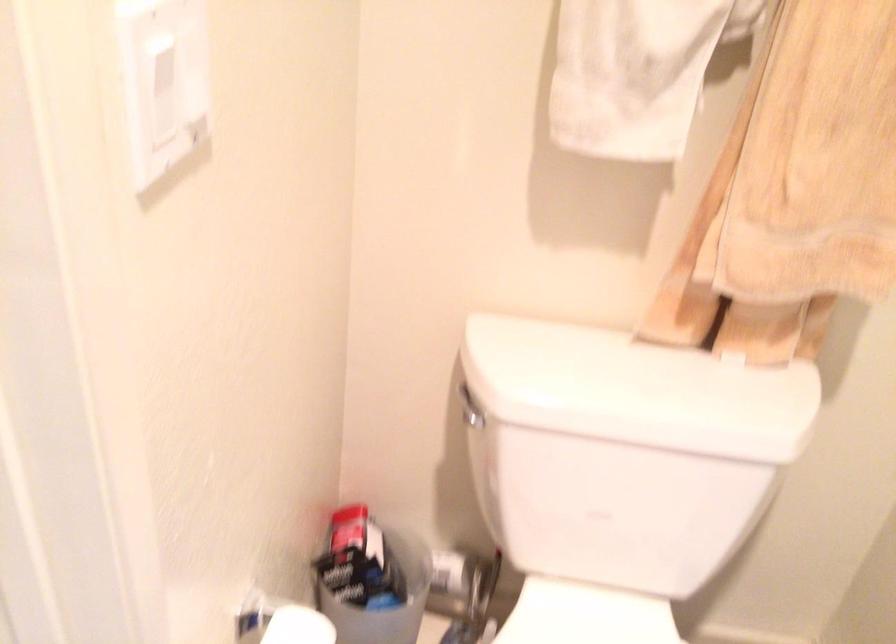
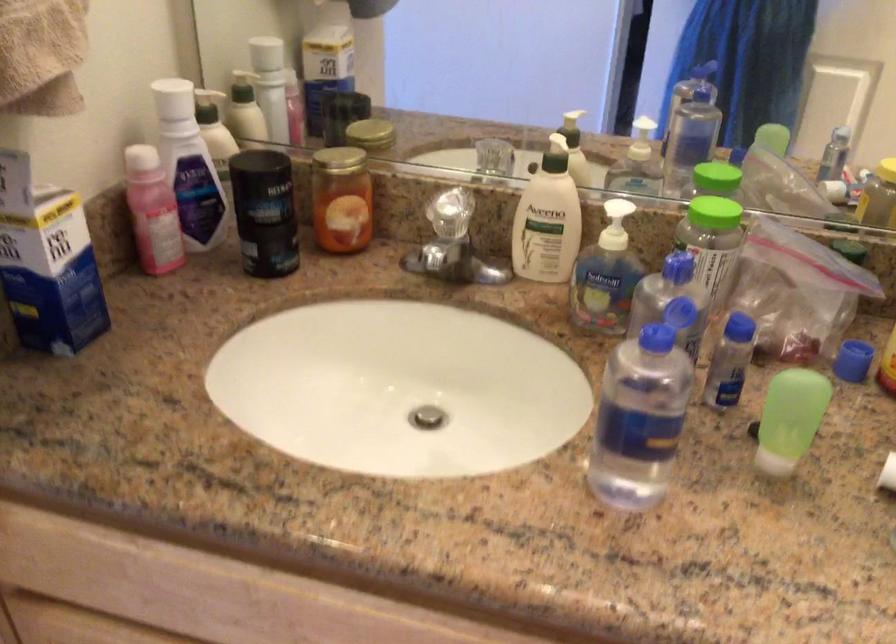
Question: The camera is either moving clockwise (left) or counter-clockwise (right) around the object. The first image is from the beginning of the video and the second image is from the end. Is the camera moving left or right when shooting the video?

Choices:
 (A) Left
 (B) Right

Answer: (B)